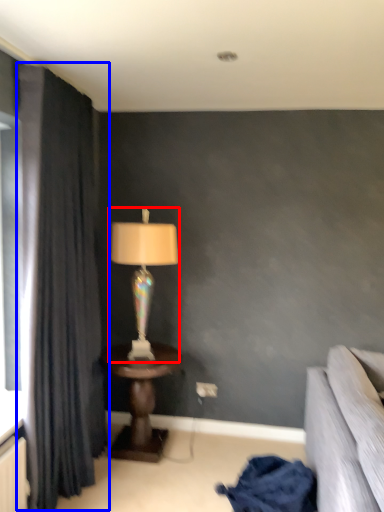
Question: Which point is further to the camera, lamp (highlighted by a red box) or curtain (highlighted by a blue box)?

Choices:
 (A) lamp
 (B) curtain

Answer: (A)